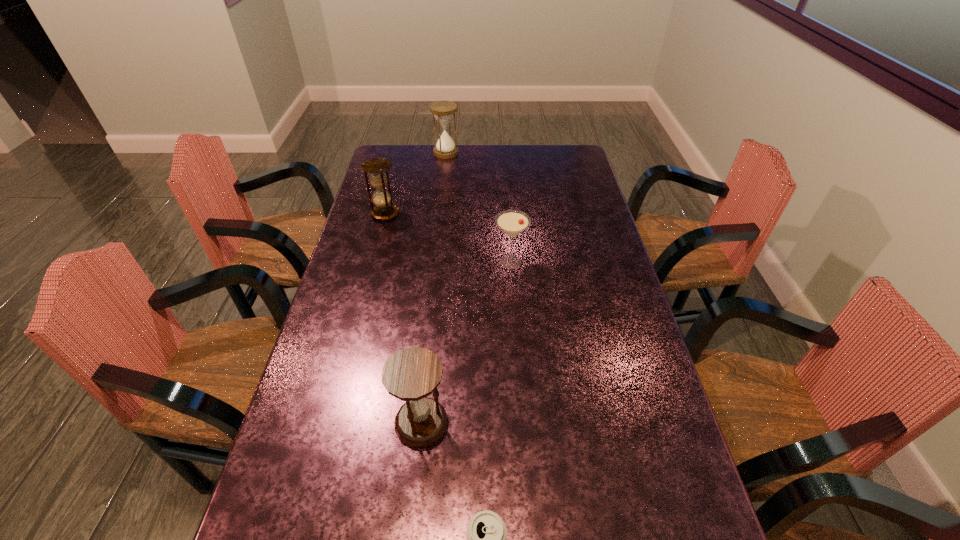
Identify the location of empty space between the second nearest hourglass and the third farthest object. Image resolution: width=960 pixels, height=540 pixels. (447, 238).

Identify the location of object that is the fourth nearest to the nearest hourglass. [443, 111].

At what (x,y) coordinates should I click in order to perform the action: click on the third closest object to the second shortest object. Please return your answer as a coordinate pair (x, y). This screenshot has height=540, width=960. Looking at the image, I should click on (443, 111).

Locate which hourglass is the second closest to the fourth tallest object. Please provide its 2D coordinates. Your answer should be formatted as a tuple, i.e. [(x, y)], where the tuple contains the x and y coordinates of a point satisfying the conditions above.

[(411, 374)]

Locate which hourglass ranks in proximity to the third nearest object. Please provide its 2D coordinates. Your answer should be formatted as a tuple, i.e. [(x, y)], where the tuple contains the x and y coordinates of a point satisfying the conditions above.

[(376, 167)]

Where is `free space that satisfies the following two spatial constraints: 1. on the back side of the fourth tallest object; 2. on the right side of the nearest hourglass`? free space that satisfies the following two spatial constraints: 1. on the back side of the fourth tallest object; 2. on the right side of the nearest hourglass is located at coordinates (438, 262).

Where is `free space in the image that satisfies the following two spatial constraints: 1. on the front side of the fourth nearest object; 2. on the right side of the nearest hourglass`? This screenshot has height=540, width=960. free space in the image that satisfies the following two spatial constraints: 1. on the front side of the fourth nearest object; 2. on the right side of the nearest hourglass is located at coordinates (330, 422).